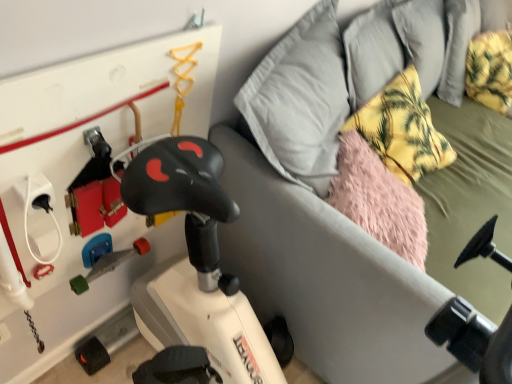
Locate an element on the screen. The height and width of the screenshot is (384, 512). white matte exercise bike at lower left is located at coordinates (326, 278).

The image size is (512, 384). What do you see at coordinates (326, 278) in the screenshot? I see `white matte exercise bike at lower left` at bounding box center [326, 278].

The image size is (512, 384). What do you see at coordinates (402, 129) in the screenshot? I see `yellow fabric pillow at upper right` at bounding box center [402, 129].

What is the approximate width of yellow fabric pillow at upper right?

13.68 inches.

The image size is (512, 384). Find the location of `yellow fabric pillow at upper right`. yellow fabric pillow at upper right is located at coordinates (402, 129).

Identify the location of white matte exercise bike at lower left. The width and height of the screenshot is (512, 384). (326, 278).

Considering the positions of objects white matte exercise bike at lower left and yellow fabric pillow at upper right in the image provided, who is more to the left, white matte exercise bike at lower left or yellow fabric pillow at upper right?

Positioned to the left is yellow fabric pillow at upper right.

Does white matte exercise bike at lower left come in front of yellow fabric pillow at upper right?

Yes, white matte exercise bike at lower left is closer to the camera.

Between point (368, 375) and point (415, 153), which one is positioned in front?

Positioned in front is point (368, 375).

From the image's perspective, which is above, white matte exercise bike at lower left or yellow fabric pillow at upper right?

yellow fabric pillow at upper right.

From a real-world perspective, is white matte exercise bike at lower left over yellow fabric pillow at upper right?

No.

Is white matte exercise bike at lower left thinner than yellow fabric pillow at upper right?

No.

Considering the sizes of objects white matte exercise bike at lower left and yellow fabric pillow at upper right in the image provided, who is taller, white matte exercise bike at lower left or yellow fabric pillow at upper right?

white matte exercise bike at lower left.

Looking at the image, does white matte exercise bike at lower left seem bigger or smaller compared to yellow fabric pillow at upper right?

white matte exercise bike at lower left is bigger than yellow fabric pillow at upper right.

Is white matte exercise bike at lower left situated inside yellow fabric pillow at upper right or outside?

white matte exercise bike at lower left exists outside the volume of yellow fabric pillow at upper right.

Is white matte exercise bike at lower left positioned far away from yellow fabric pillow at upper right?

white matte exercise bike at lower left is actually quite close to yellow fabric pillow at upper right.

Is white matte exercise bike at lower left aimed at yellow fabric pillow at upper right?

Yes.

How many degrees apart are the facing directions of white matte exercise bike at lower left and yellow fabric pillow at upper right?

There is a 9.56-degree angle between the facing directions of white matte exercise bike at lower left and yellow fabric pillow at upper right.

What are the coordinates of `furniture that appears below the yellow fabric pillow at upper right (from the image's perspective)` in the screenshot? It's located at (326, 278).

Which is more to the left, yellow fabric pillow at upper right or white matte exercise bike at lower left?

yellow fabric pillow at upper right.

Which is behind, yellow fabric pillow at upper right or white matte exercise bike at lower left?

yellow fabric pillow at upper right is more distant.

Is point (401, 141) closer or farther from the camera than point (248, 175)?

Point (401, 141) appears to be farther away from the viewer than point (248, 175).

From the image's perspective, is yellow fabric pillow at upper right under white matte exercise bike at lower left?

No, from the image's perspective, yellow fabric pillow at upper right is not beneath white matte exercise bike at lower left.

From a real-world perspective, is yellow fabric pillow at upper right physically below white matte exercise bike at lower left?

No, from a real-world perspective, yellow fabric pillow at upper right is not under white matte exercise bike at lower left.

Which object is thinner, yellow fabric pillow at upper right or white matte exercise bike at lower left?

Thinner between the two is yellow fabric pillow at upper right.

Is yellow fabric pillow at upper right taller or shorter than white matte exercise bike at lower left?

In the image, yellow fabric pillow at upper right appears to be shorter than white matte exercise bike at lower left.

Looking at this image, between yellow fabric pillow at upper right and white matte exercise bike at lower left, which one has larger size?

With larger size is white matte exercise bike at lower left.

Would you say yellow fabric pillow at upper right is inside or outside white matte exercise bike at lower left?

yellow fabric pillow at upper right exists entirely within white matte exercise bike at lower left.

Looking at this image, is yellow fabric pillow at upper right directly adjacent to white matte exercise bike at lower left?

No.

Could you tell me if yellow fabric pillow at upper right is turned towards white matte exercise bike at lower left?

Yes, yellow fabric pillow at upper right is aimed at white matte exercise bike at lower left.

The height and width of the screenshot is (384, 512). Find the location of `pillow above the white matte exercise bike at lower left (from a real-world perspective)`. pillow above the white matte exercise bike at lower left (from a real-world perspective) is located at coordinates (402, 129).

In the image, there is a white matte exercise bike at lower left. What are the coordinates of `pillow above it (from the image's perspective)` in the screenshot? It's located at (402, 129).

This screenshot has height=384, width=512. I want to click on pillow located on the left of white matte exercise bike at lower left, so click(402, 129).